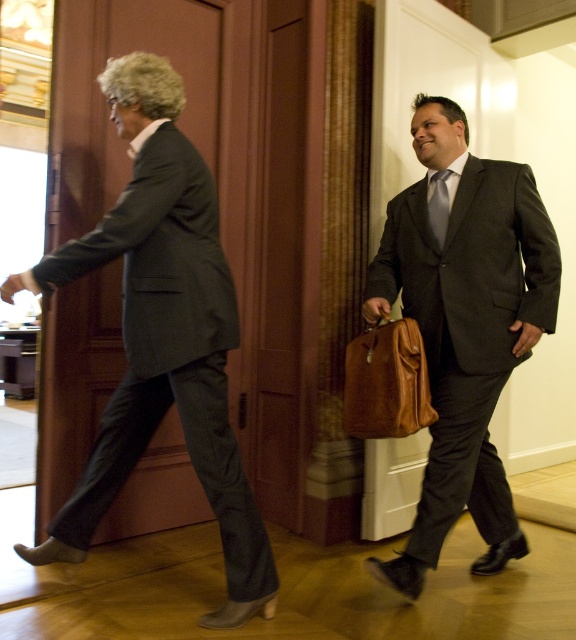
You are a security camera in the hallway. You need to track the position of the matte black suit at left. What are its coordinates?

The coordinates of the matte black suit at left are at point (161,336).

You are a security guard in the building and need to determine which object is bigger between the brown leather briefcase at center and the silky blue tie at center. Which one is larger?

The brown leather briefcase at center has a larger size compared to the silky blue tie at center, so the brown leather briefcase at center is bigger.